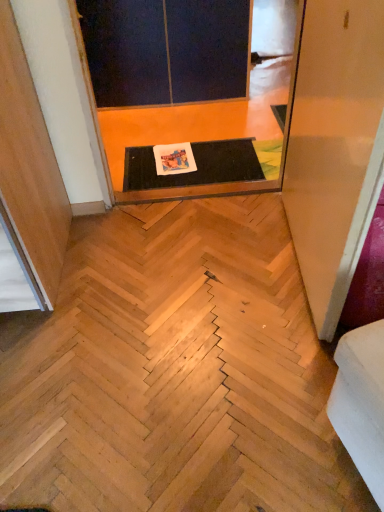
At what (x,y) coordinates should I click in order to perform the action: click on free space in front of transparent plastic screen door at upper right, placed as the 3th screen door when sorted from back to front. Please return your answer as a coordinate pair (x, y). The image size is (384, 512). Looking at the image, I should click on (261, 367).